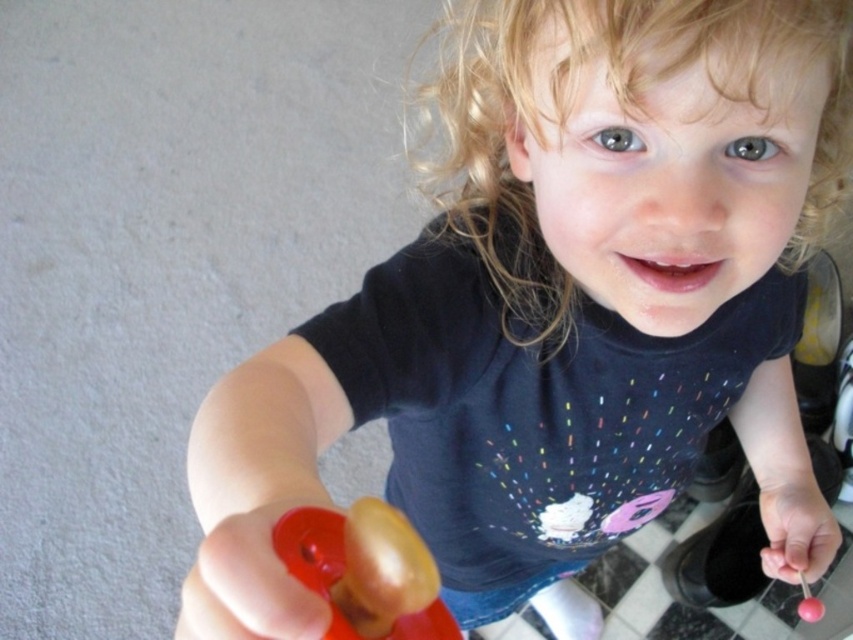
From the picture: You are a photographer setting up for a portrait. The subject is the child holding the rubberized plastic toy at lower center. To ensure the toy is in focus, where should you position your camera focus point?

The rubberized plastic toy at lower center is positioned at point [364,572], so you should set the camera focus point to that coordinate to ensure it is in focus.

From the picture: You are a photographer adjusting your camera settings to focus on the child in the image. The camera has a focus point at coordinates point (364,572). Based on the scene description, what object is the focus point likely targeting?

The focus point at coordinates point (364,572) is targeting the rubberized plastic toy at lower center.

You are a toy collector who wants to display both the rubberized plastic toy at lower center and the pink rubber lollipop at lower right on a shelf. Based on their positions in the image, which toy should you place to the left of the other to match the original arrangement?

The rubberized plastic toy at lower center should be placed to the left of the pink rubber lollipop at lower right to match the original arrangement, as it was positioned on the left side of the pink rubber lollipop at lower right in the image.